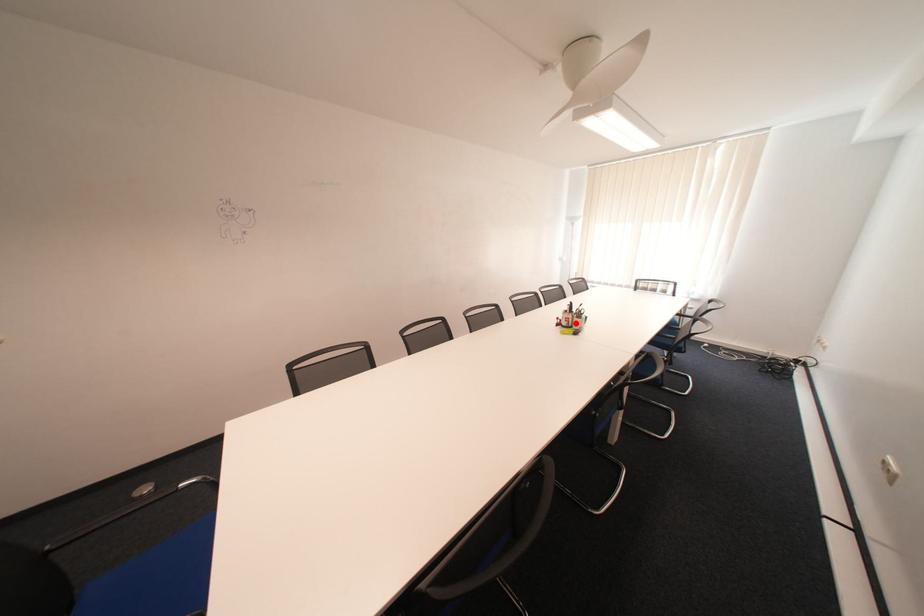
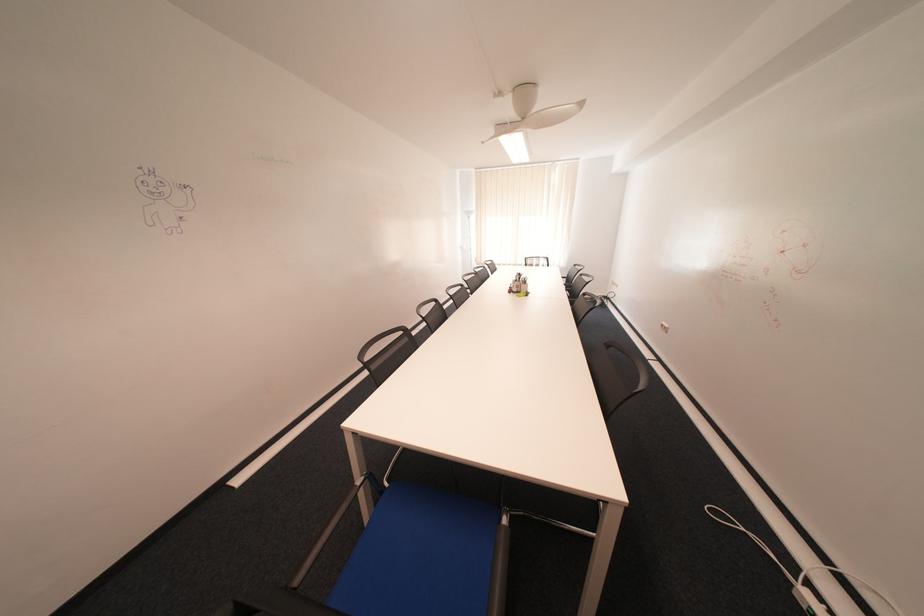
In the second image, find the point that corresponds to the highlighted location in the first image.

(526, 290)